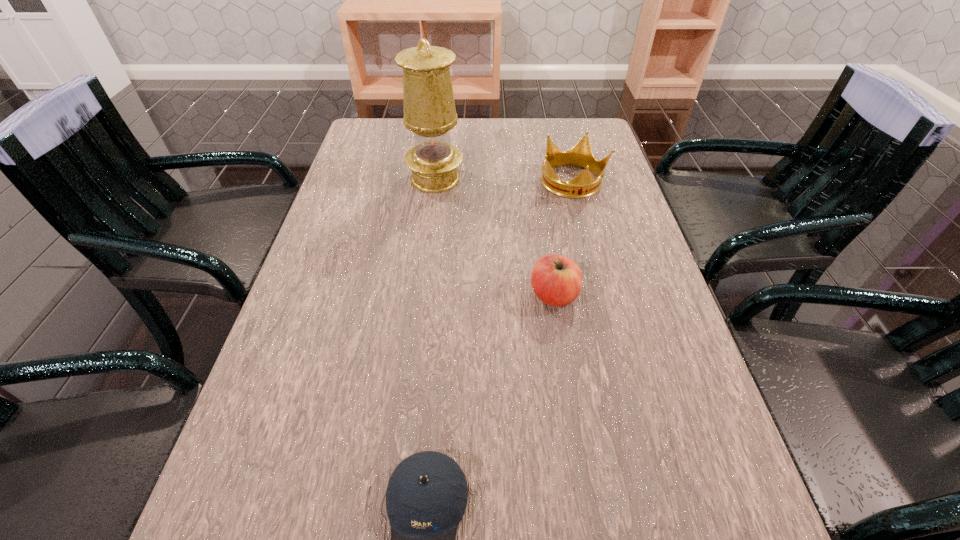
Find the location of a particular element. The height and width of the screenshot is (540, 960). oil lamp is located at coordinates (429, 108).

This screenshot has height=540, width=960. Identify the location of crown. (584, 185).

Where is `the third farthest object`? the third farthest object is located at coordinates (556, 280).

Identify the location of vacant region located on the left of the oil lamp. This screenshot has width=960, height=540. (357, 179).

What are the coordinates of `vacant area situated on the back of the crown` in the screenshot? It's located at (564, 150).

Where is `vacant point located 0.090m on the left of the apple`? The width and height of the screenshot is (960, 540). vacant point located 0.090m on the left of the apple is located at coordinates (486, 296).

Where is `object positioned at the right edge`? This screenshot has width=960, height=540. object positioned at the right edge is located at coordinates (584, 185).

The height and width of the screenshot is (540, 960). What are the coordinates of `free space at the far edge` in the screenshot? It's located at (496, 127).

The width and height of the screenshot is (960, 540). Identify the location of vacant position at the left edge of the desktop. (302, 502).

Where is `free space at the right edge of the desktop`? This screenshot has height=540, width=960. free space at the right edge of the desktop is located at coordinates (594, 241).